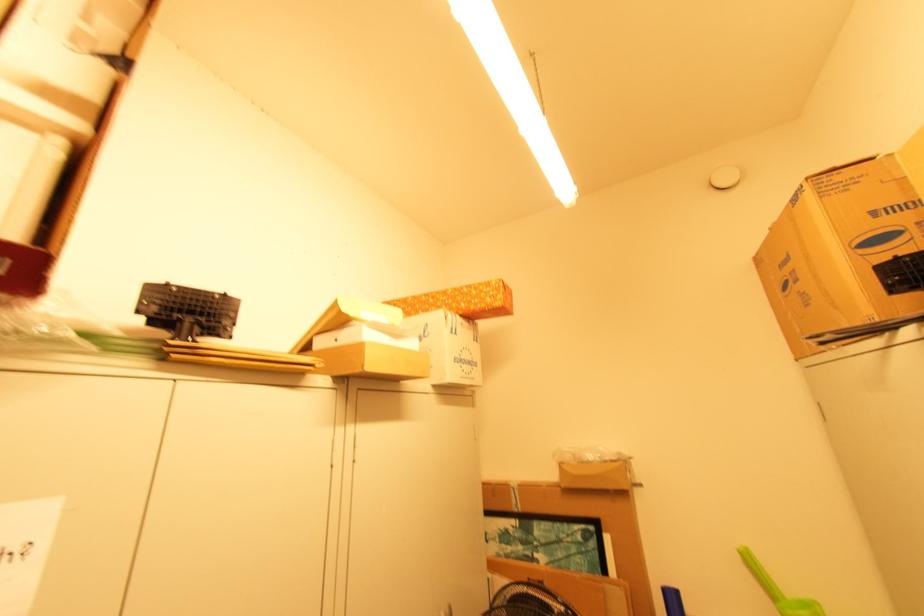
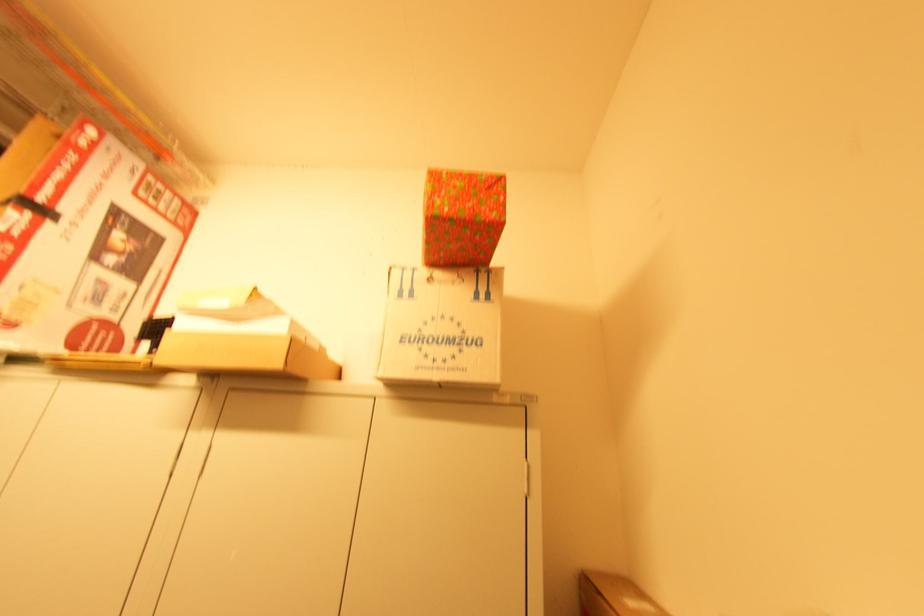
In the second image, find the point that corresponds to point 460,357 in the first image.

(418, 333)